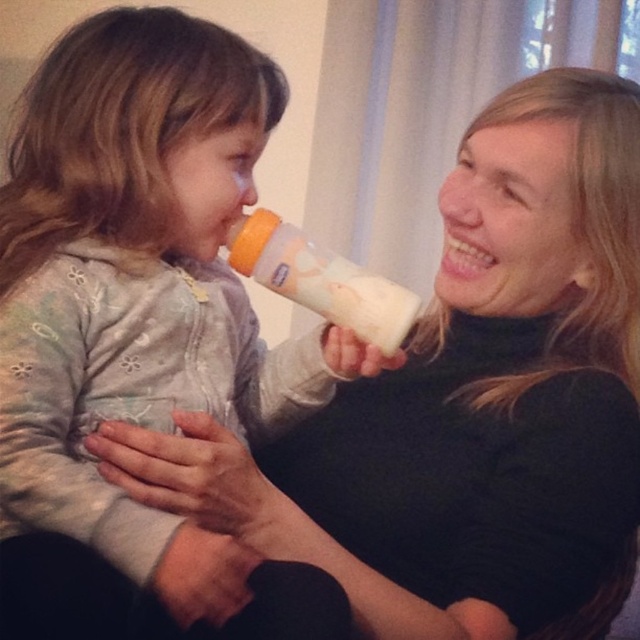
Does white soft baby bottle at center come in front of white matte bottle at center?

Yes, white soft baby bottle at center is closer to the viewer.

Is white soft baby bottle at center above white matte bottle at center?

Actually, white soft baby bottle at center is below white matte bottle at center.

Between point (54, 444) and point (310, 289), which one is positioned in front?

Point (54, 444) is in front.

At what (x,y) coordinates should I click in order to perform the action: click on white soft baby bottle at center. Please return your answer as a coordinate pair (x, y). Image resolution: width=640 pixels, height=640 pixels. Looking at the image, I should click on (141, 330).